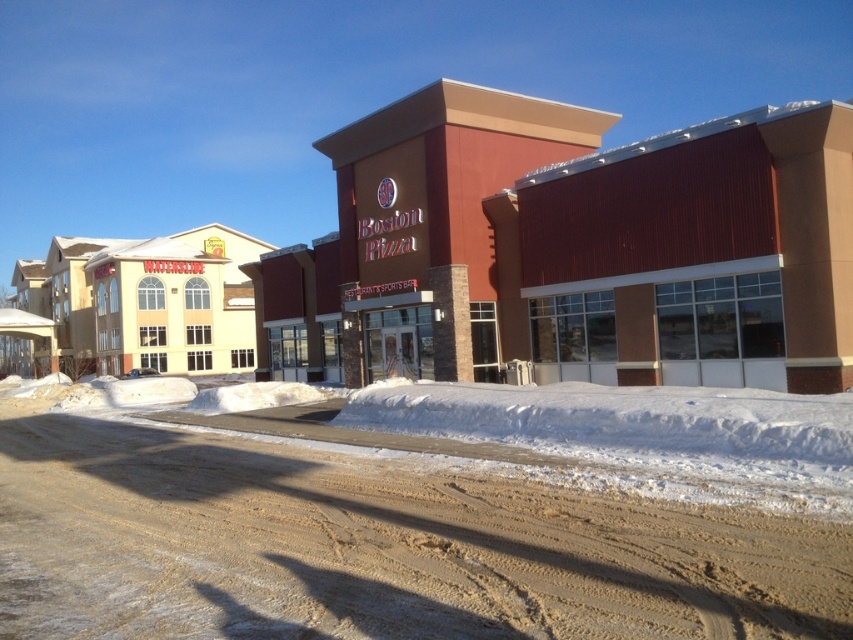
You are a delivery driver approaching the Boston Pizza building. You need to park your vehicle near the matte brick building at center and the brown sandy dirt track at lower center. Which location offers more space for parking based on their sizes?

The matte brick building at center has a larger size compared to the brown sandy dirt track at lower center, so it likely offers more space for parking.

Looking at this image, you are standing at the entrance of the Boston Pizza building and want to walk to the matte brick building at center. Which direction should you head relative to the Boston Pizza building?

The matte brick building at center is located at point coordinates relative to the Boston Pizza building, so you should head towards the center direction from the Boston Pizza entrance.